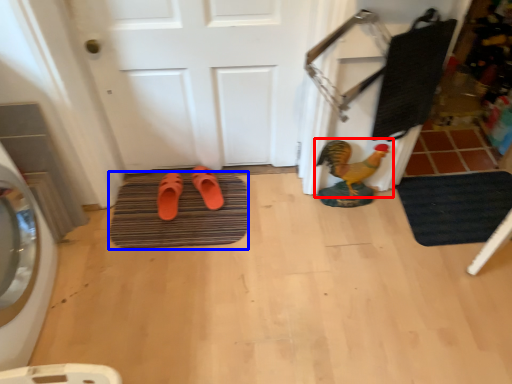
Question: Which of the following is the closest to the observer, chicken (highlighted by a red box) or bath mat (highlighted by a blue box)?

Choices:
 (A) chicken
 (B) bath mat

Answer: (A)